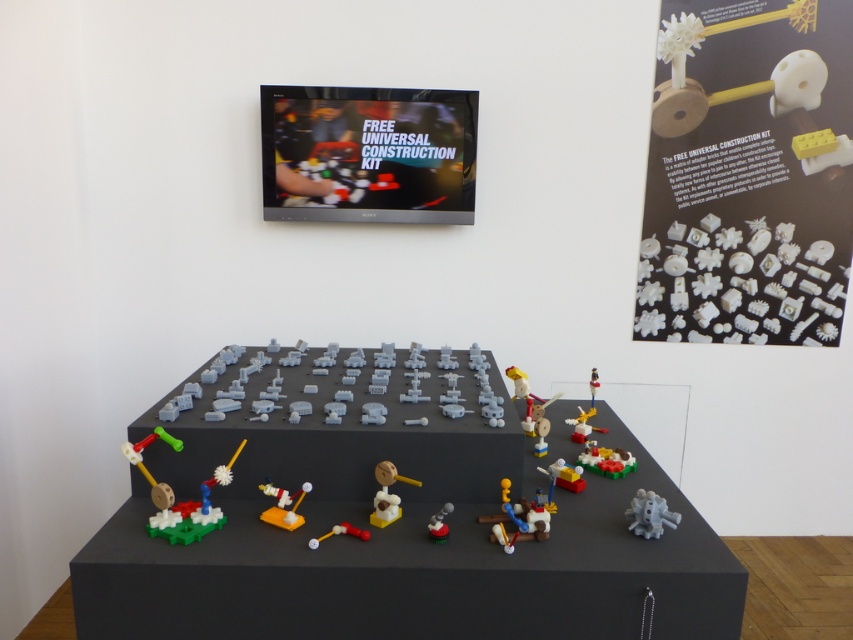
You are a GUI agent. You are given a task and a screenshot of the screen. Output one action in this format:
    pyautogui.click(x=<x>, y=<y>)
    Task: Click on the white plastic gear at upper right
    
    Given the screenshot: What is the action you would take?
    pyautogui.click(x=747, y=173)

I want to click on white plastic gear at upper right, so click(747, 173).

Find the location of `white plastic gear at upper right`. white plastic gear at upper right is located at coordinates (747, 173).

Can you confirm if matte yellow figure at center right is positioned to the left of translucent plastic toy at center?

Correct, you'll find matte yellow figure at center right to the left of translucent plastic toy at center.

Is matte yellow figure at center right bigger than translucent plastic toy at center?

Indeed, matte yellow figure at center right has a larger size compared to translucent plastic toy at center.

Which is in front, point (561, 392) or point (560, 461)?

Point (560, 461) is more forward.

Find the location of a particular element. matte yellow figure at center right is located at coordinates (527, 401).

Is white plastic gears at upper right below translucent plastic toy at center?

No.

Is white plastic gears at upper right smaller than translucent plastic toy at center?

Actually, white plastic gears at upper right might be larger than translucent plastic toy at center.

You are a GUI agent. You are given a task and a screenshot of the screen. Output one action in this format:
    pyautogui.click(x=<x>, y=<y>)
    Task: Click on the white plastic gears at upper right
    Image resolution: width=853 pixels, height=640 pixels.
    Given the screenshot: What is the action you would take?
    pyautogui.click(x=738, y=284)

Where is `white plastic gears at upper right`? This screenshot has height=640, width=853. white plastic gears at upper right is located at coordinates (738, 284).